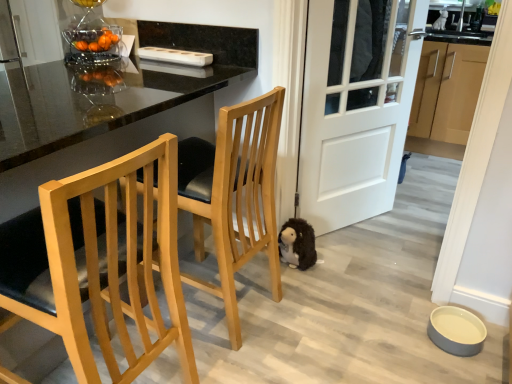
Question: Is the depth of fuzzy brown stuffed animal at lower center less than that of light wood/black cushioned seat at center, which is the second chair in front-to-back order?

Choices:
 (A) yes
 (B) no

Answer: (B)

Question: Could you tell me if fuzzy brown stuffed animal at lower center is facing light wood/black cushioned seat at center, which is the second chair in front-to-back order?

Choices:
 (A) no
 (B) yes

Answer: (B)

Question: Can you confirm if fuzzy brown stuffed animal at lower center is positioned to the left of light wood/black cushioned seat at center, which is the second chair in front-to-back order?

Choices:
 (A) yes
 (B) no

Answer: (B)

Question: From the image's perspective, is fuzzy brown stuffed animal at lower center over light wood/black cushioned seat at center, which appears as the 1th chair when viewed from the back?

Choices:
 (A) no
 (B) yes

Answer: (A)

Question: Is fuzzy brown stuffed animal at lower center bigger than light wood/black cushioned seat at center, which appears as the 1th chair when viewed from the back?

Choices:
 (A) no
 (B) yes

Answer: (A)

Question: Based on their sizes in the image, would you say light brown wood cabinets at right is bigger or smaller than fuzzy brown stuffed animal at lower center?

Choices:
 (A) small
 (B) big

Answer: (B)

Question: Is light brown wood cabinets at right inside the boundaries of fuzzy brown stuffed animal at lower center, or outside?

Choices:
 (A) inside
 (B) outside

Answer: (B)

Question: From a real-world perspective, is light brown wood cabinets at right positioned above or below fuzzy brown stuffed animal at lower center?

Choices:
 (A) above
 (B) below

Answer: (A)

Question: From the image's perspective, is light brown wood cabinets at right located above or below fuzzy brown stuffed animal at lower center?

Choices:
 (A) above
 (B) below

Answer: (A)

Question: Is light wood/black cushioned seat at center, which is the second chair in front-to-back order, inside the boundaries of white matte door at center, or outside?

Choices:
 (A) outside
 (B) inside

Answer: (A)

Question: From the image's perspective, is light wood/black cushioned seat at center, which is the second chair in front-to-back order, positioned above or below white matte door at center?

Choices:
 (A) below
 (B) above

Answer: (A)

Question: Considering the positions of point (221, 213) and point (371, 34), is point (221, 213) closer or farther from the camera than point (371, 34)?

Choices:
 (A) farther
 (B) closer

Answer: (B)

Question: Is light wood/black cushioned seat at center, which appears as the 1th chair when viewed from the back, in front of or behind white matte door at center in the image?

Choices:
 (A) behind
 (B) front

Answer: (B)

Question: From a real-world perspective, is light brown wood cabinets at right above or below light wood/texture chair at left, the 1th chair in the front-to-back sequence?

Choices:
 (A) below
 (B) above

Answer: (B)

Question: Visually, is light brown wood cabinets at right positioned to the left or to the right of light wood/texture chair at left, the second chair from the back?

Choices:
 (A) right
 (B) left

Answer: (A)